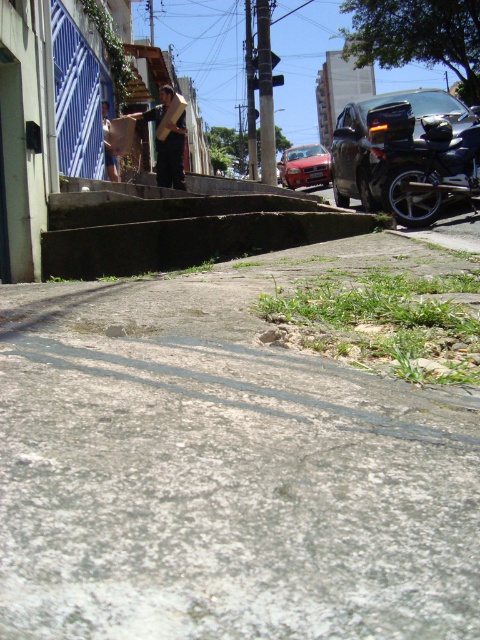
Question: Which object is closer to the camera taking this photo?

Choices:
 (A) brown concrete stairs at center
 (B) shiny black car at upper right

Answer: (A)

Question: Which point appears closest to the camera in this image?

Choices:
 (A) [337, 124]
 (B) [299, 182]

Answer: (A)

Question: Which object is positioned closest to the wooden skateboard at center?

Choices:
 (A) matte red car at center
 (B) gray concrete pavement at lower center
 (C) shiny black car at upper right
 (D) brown concrete stairs at center

Answer: (C)

Question: Is matte red car at center wider than brown leather jacket at upper center?

Choices:
 (A) yes
 (B) no

Answer: (A)

Question: Does gray concrete pavement at lower center appear on the left side of shiny black car at upper right?

Choices:
 (A) yes
 (B) no

Answer: (A)

Question: Is matte red car at center wider than brown leather jacket at upper center?

Choices:
 (A) yes
 (B) no

Answer: (A)